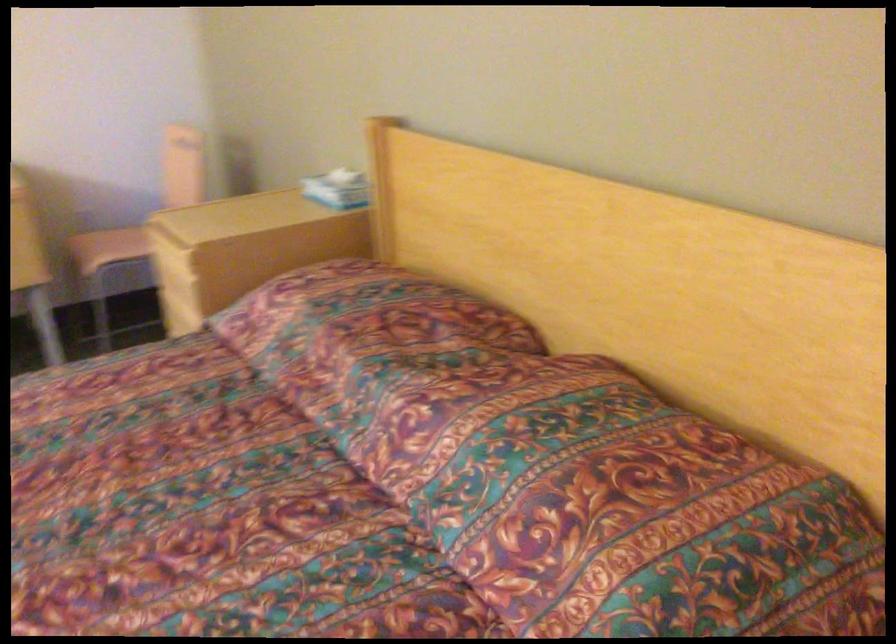
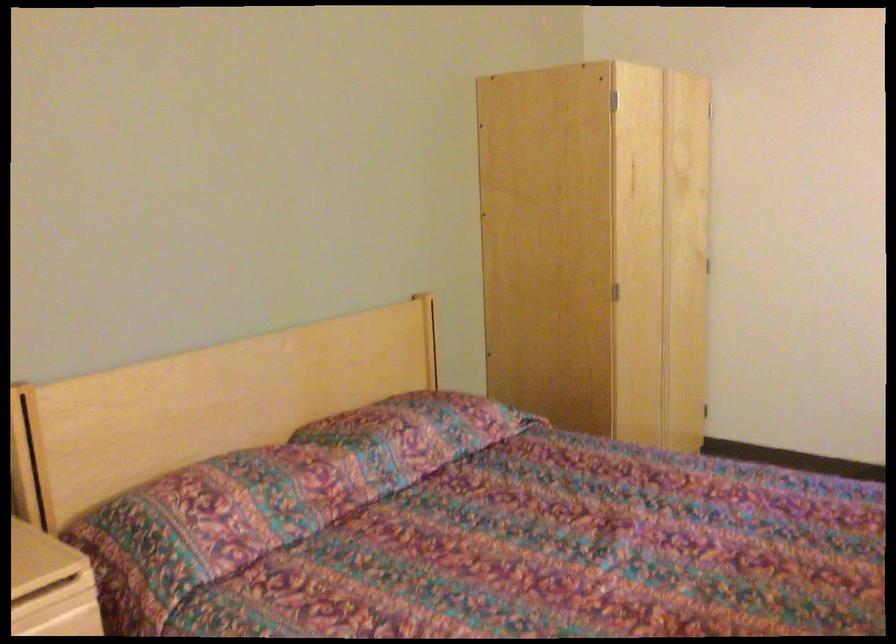
Where in the second image is the point corresponding to point 428,424 from the first image?

(414, 433)